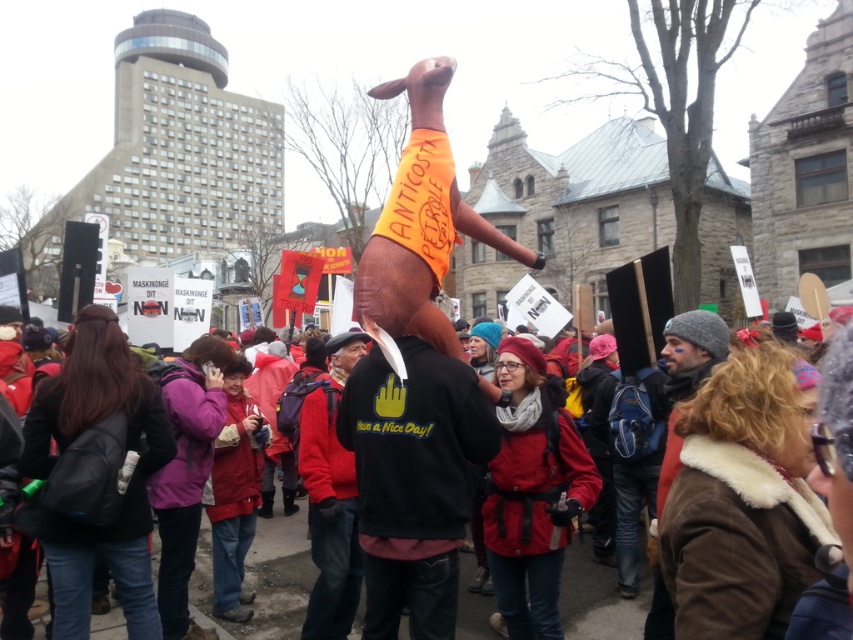
Question: Is matte black jacket at center wider than brown fur coat at right?

Choices:
 (A) no
 (B) yes

Answer: (B)

Question: Does red fleece jacket at center appear over brown fur coat at right?

Choices:
 (A) no
 (B) yes

Answer: (A)

Question: Among these objects, which one is farthest from the camera?

Choices:
 (A) red fleece jacket at center
 (B) matte black jacket at center

Answer: (A)

Question: Can you confirm if black matte hoodie at center is wider than brown fur coat at right?

Choices:
 (A) no
 (B) yes

Answer: (B)

Question: Which point is farther to the camera?

Choices:
 (A) (311, 499)
 (B) (450, 605)
 (C) (274, 547)

Answer: (C)

Question: Which of these objects is positioned closest to the red fleece jacket at center?

Choices:
 (A) matte black jacket at center
 (B) black matte hoodie at center

Answer: (B)